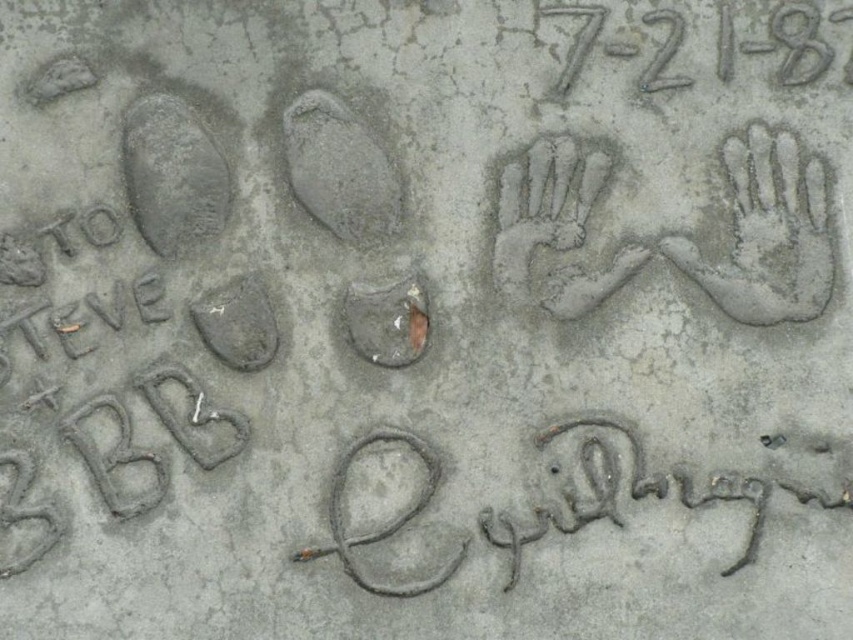
Measure the distance between smooth concrete footprint at center and camera.

smooth concrete footprint at center and camera are 4.38 feet apart.

Can you confirm if smooth concrete footprint at center is smaller than gray concrete footprint at center-left?

Indeed, smooth concrete footprint at center has a smaller size compared to gray concrete footprint at center-left.

Who is more distant from viewer, [408,337] or [204,296]?

Point [408,337]

Find the location of a particular element. The image size is (853, 640). smooth concrete footprint at center is located at coordinates (387, 321).

Does gray concrete footprint at center appear on the left side of gray concrete footprint at center-left?

No, gray concrete footprint at center is not to the left of gray concrete footprint at center-left.

Who is positioned more to the right, gray concrete footprint at center or gray concrete footprint at center-left?

gray concrete footprint at center

Where is `gray concrete footprint at center`? The height and width of the screenshot is (640, 853). gray concrete footprint at center is located at coordinates (340, 170).

Is gray concrete footprint at upper left wider than gray concrete footprint at center-left?

Yes.

Which is more to the right, gray concrete footprint at upper left or gray concrete footprint at center-left?

gray concrete footprint at center-left

Describe the element at coordinates (172, 173) in the screenshot. I see `gray concrete footprint at upper left` at that location.

Locate an element on the screen. The height and width of the screenshot is (640, 853). gray concrete footprint at upper left is located at coordinates click(x=172, y=173).